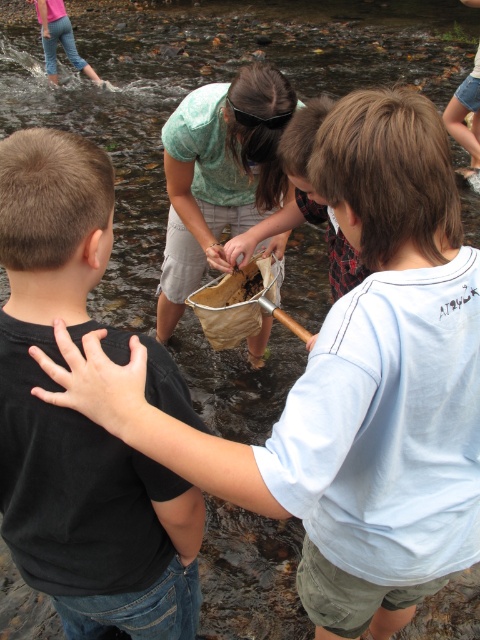
Question: Is black matte shirt at left below denim shorts at lower right?

Choices:
 (A) yes
 (B) no

Answer: (A)

Question: Where is black matte shirt at left located in relation to denim shorts at lower right in the image?

Choices:
 (A) left
 (B) right

Answer: (A)

Question: Which point appears farthest from the camera in this image?

Choices:
 (A) (11, 524)
 (B) (447, 116)

Answer: (B)

Question: Among these objects, which one is nearest to the camera?

Choices:
 (A) black matte shirt at left
 (B) denim shorts at lower right

Answer: (A)

Question: Among these objects, which one is farthest from the camera?

Choices:
 (A) black matte shirt at left
 (B) denim shorts at lower right

Answer: (B)

Question: Does black matte shirt at left appear on the left side of denim shorts at lower right?

Choices:
 (A) no
 (B) yes

Answer: (B)